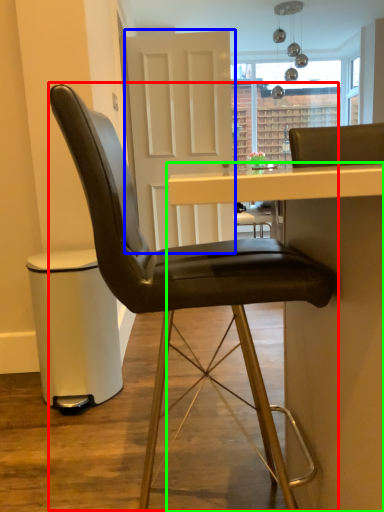
Question: Which object is positioned closest to chair (highlighted by a red box)? Select from glass door (highlighted by a blue box) and table (highlighted by a green box).

Choices:
 (A) glass door
 (B) table

Answer: (B)